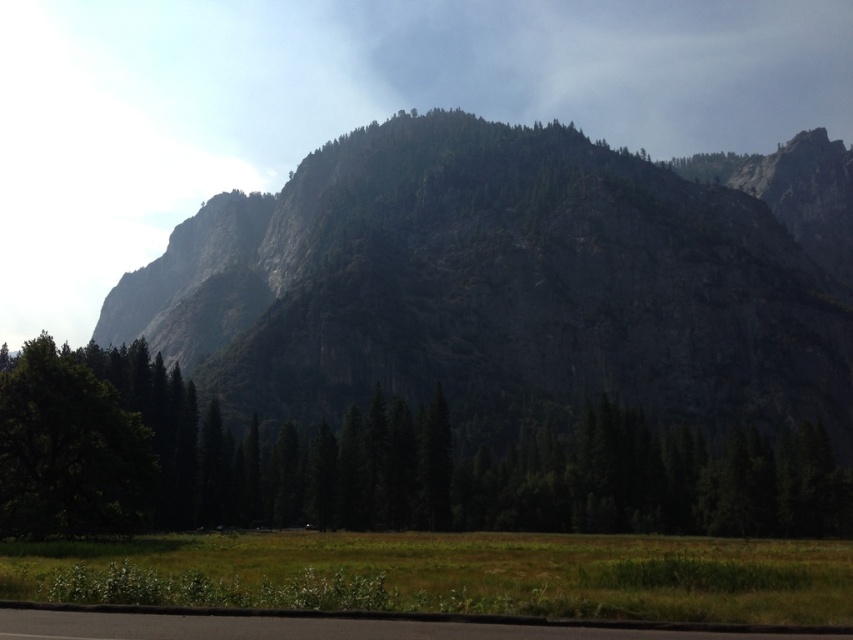
Question: Can you confirm if transparent white cloud at upper center is positioned below green matte tree at center?

Choices:
 (A) no
 (B) yes

Answer: (A)

Question: Which point is farther from the camera taking this photo?

Choices:
 (A) (245, 163)
 (B) (732, 627)

Answer: (A)

Question: Is granite rock formation at center further to the viewer compared to transparent white cloud at upper center?

Choices:
 (A) no
 (B) yes

Answer: (A)

Question: Which object is the closest to the black asphalt road at lower center?

Choices:
 (A) transparent white cloud at upper center
 (B) granite rock formation at center

Answer: (B)

Question: Is granite rock formation at center below black asphalt road at lower center?

Choices:
 (A) yes
 (B) no

Answer: (B)

Question: Considering the real-world distances, which object is farthest from the granite rock formation at center?

Choices:
 (A) transparent white cloud at upper center
 (B) black asphalt road at lower center
 (C) green matte tree at center

Answer: (B)